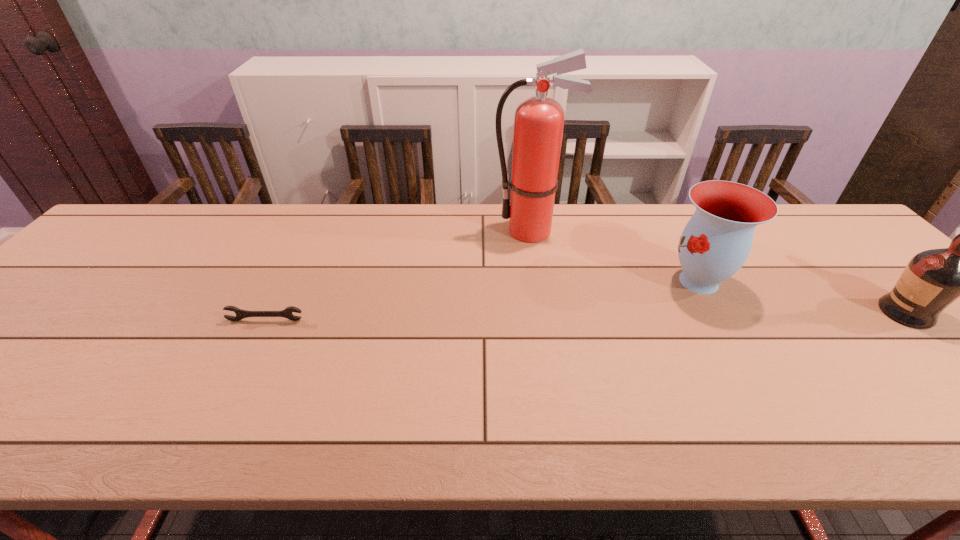
At what (x,y) coordinates should I click in order to perform the action: click on the tallest object. Please return your answer as a coordinate pair (x, y). This screenshot has width=960, height=540. Looking at the image, I should click on (539, 120).

Identify the location of the third object from right to left. The height and width of the screenshot is (540, 960). (539, 120).

At what (x,y) coordinates should I click in order to perform the action: click on liquor. Please return your answer as a coordinate pair (x, y). This screenshot has width=960, height=540. Looking at the image, I should click on (933, 279).

This screenshot has height=540, width=960. What are the coordinates of `the second tallest object` in the screenshot? It's located at (933, 279).

The width and height of the screenshot is (960, 540). In order to click on the third object from left to right in this screenshot , I will do `click(715, 243)`.

Locate an element on the screen. This screenshot has height=540, width=960. the third tallest object is located at coordinates (715, 243).

Image resolution: width=960 pixels, height=540 pixels. What are the coordinates of `the shortest object` in the screenshot? It's located at (287, 312).

Image resolution: width=960 pixels, height=540 pixels. Identify the location of wrench. (287, 312).

This screenshot has height=540, width=960. In order to click on vacant space located on the hose direction of the third object from right to left in this screenshot , I will do `click(363, 231)`.

Identify the location of blank space located on the hose direction of the third object from right to left. (440, 231).